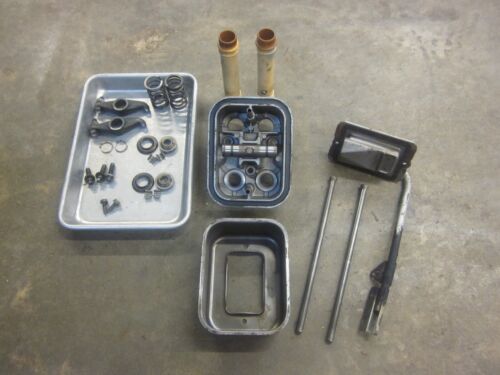
Find the location of a particular element. floor is located at coordinates (120, 41).